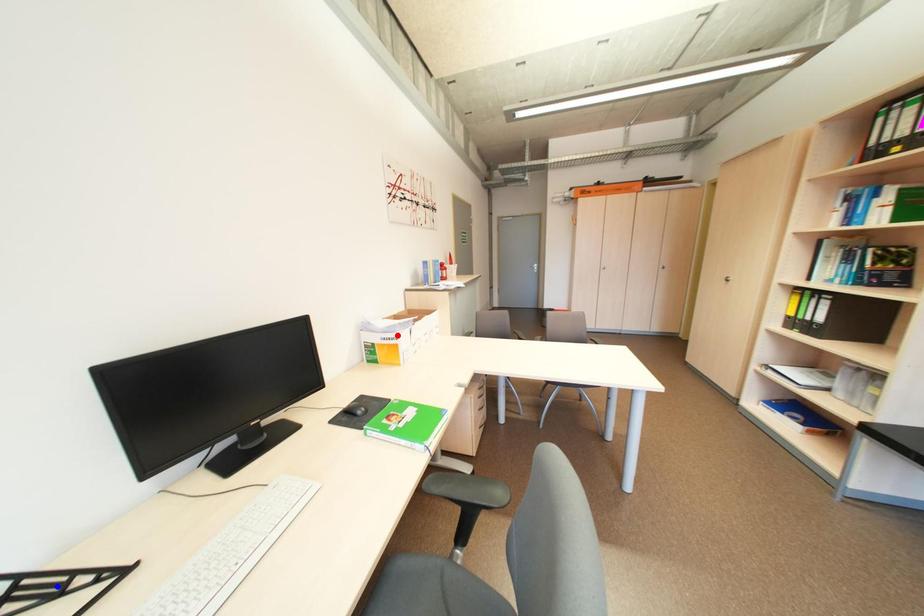
Question: Two points are marked on the image. Which point is closer to the camera?

Choices:
 (A) Blue point is closer.
 (B) Red point is closer.

Answer: (A)